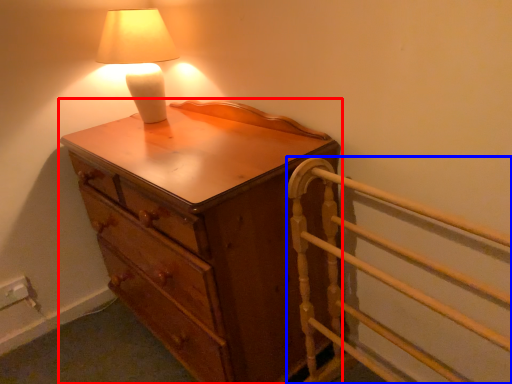
Question: Among these objects, which one is farthest to the camera, chest of drawers (highlighted by a red box) or bed frame (highlighted by a blue box)?

Choices:
 (A) chest of drawers
 (B) bed frame

Answer: (A)